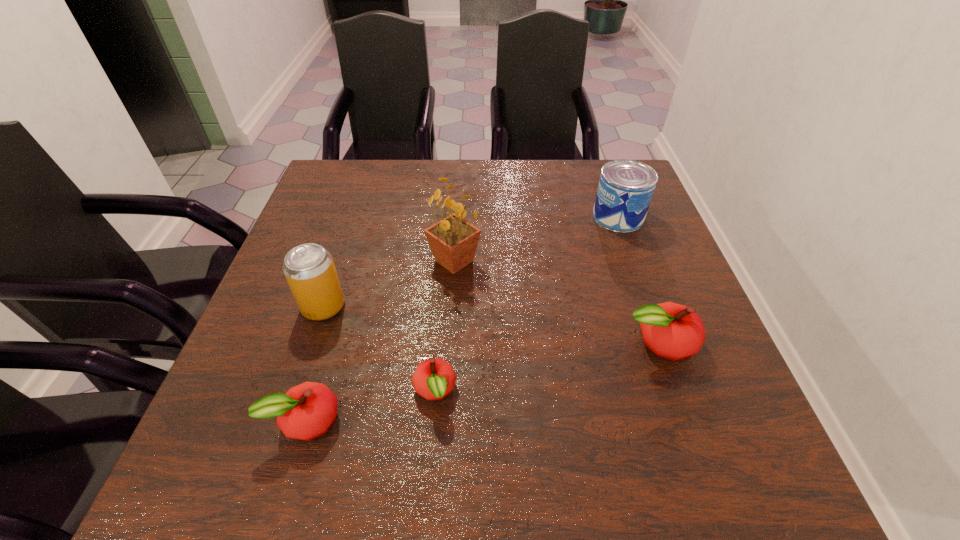
This screenshot has height=540, width=960. Identify the location of empty location between the sunflower and the farthest object. (537, 239).

Find the location of a particular element. free space between the tallest object and the shortest apple is located at coordinates (444, 326).

Where is `vacant space that is in between the pop (soda) and the rightmost apple`? The height and width of the screenshot is (540, 960). vacant space that is in between the pop (soda) and the rightmost apple is located at coordinates (491, 325).

Locate an element on the screen. vacant area that lies between the shortest apple and the third shortest object is located at coordinates (546, 367).

At what (x,y) coordinates should I click in order to perform the action: click on empty space between the sunflower and the rightmost apple. Please return your answer as a coordinate pair (x, y). The image size is (960, 540). Looking at the image, I should click on (556, 302).

The width and height of the screenshot is (960, 540). In order to click on blank region between the can and the second farthest object in this screenshot , I will do `click(537, 239)`.

Locate an element on the screen. The height and width of the screenshot is (540, 960). vacant space that is in between the second tallest apple and the tallest object is located at coordinates (380, 340).

This screenshot has width=960, height=540. In order to click on free space between the second farthest object and the shortest object in this screenshot , I will do `click(444, 326)`.

Where is `free space between the fifth tallest object and the second apple from left to right`? The height and width of the screenshot is (540, 960). free space between the fifth tallest object and the second apple from left to right is located at coordinates (371, 406).

Choose which object is the nearest neighbor to the shortest object. Please provide its 2D coordinates. Your answer should be formatted as a tuple, i.e. [(x, y)], where the tuple contains the x and y coordinates of a point satisfying the conditions above.

[(306, 411)]